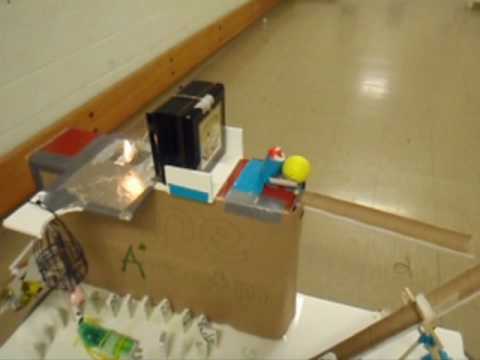
At what (x,y) coordinates should I click in order to perform the action: click on red stool. Please return your answer as a coordinate pair (x, y). Looking at the image, I should click on (68, 144).